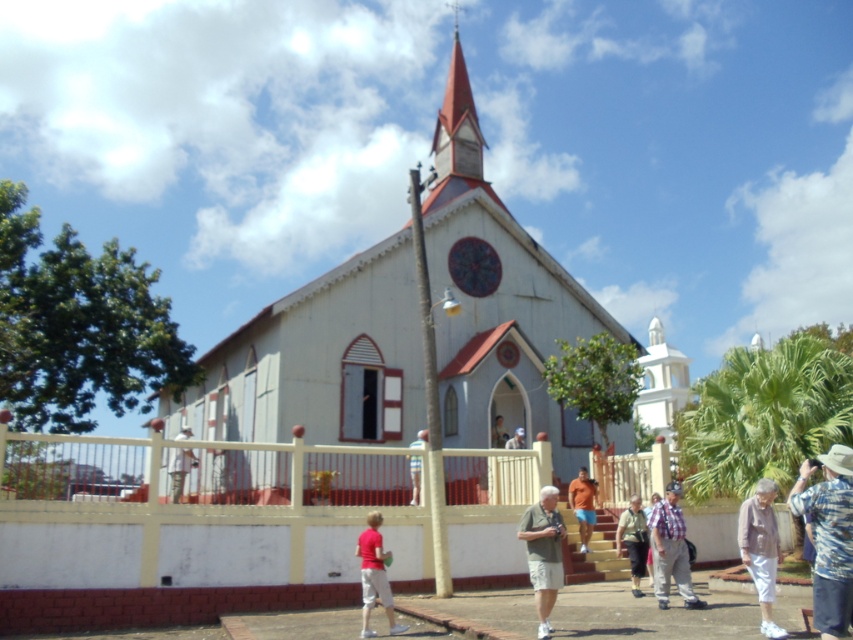
You are standing in front of the church and want to take a photo that includes both the red steeple and the circular window. You notice two points marked on the ground at coordinates point (648, 355) and point (759, 584). Which point is closer to you, the photographer?

Point (648, 355) is further to the camera than point (759, 584), so the point closer to you is point (759, 584).

You are standing in front of the church and want to walk from the white wooden chapel at center to the white cotton pants at lower right. Which direction should you move relative to the chapel?

You should move away from the white wooden chapel at center towards the white cotton pants at lower right because the white cotton pants at lower right are closer to the viewer than the white wooden chapel at center.